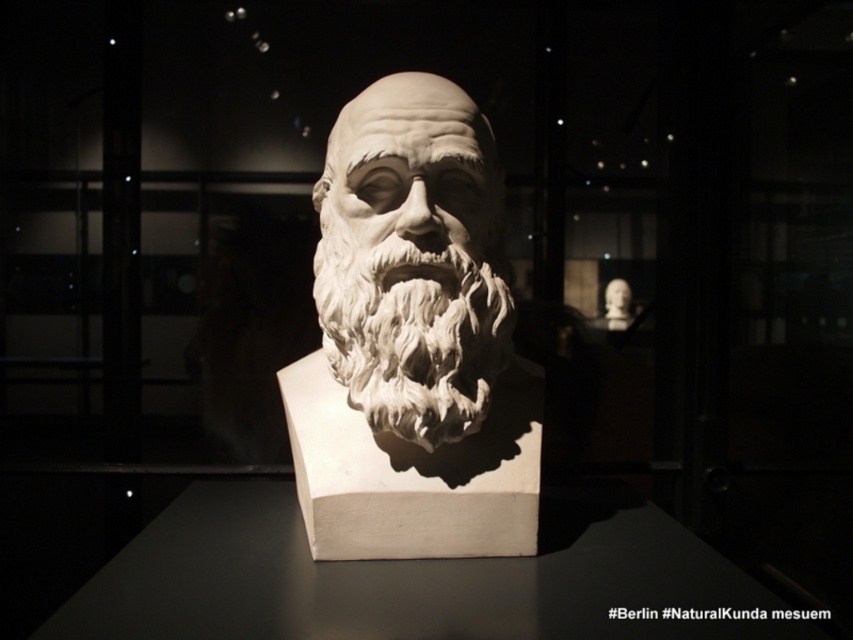
Between white marble bust at center and white marble beard at center, which one has less height?

With less height is white marble beard at center.

What do you see at coordinates (412, 340) in the screenshot? The width and height of the screenshot is (853, 640). I see `white marble bust at center` at bounding box center [412, 340].

Between point (469, 429) and point (428, 330), which one is positioned in front?

Positioned in front is point (428, 330).

Where is `white marble bust at center`? This screenshot has width=853, height=640. white marble bust at center is located at coordinates (412, 340).